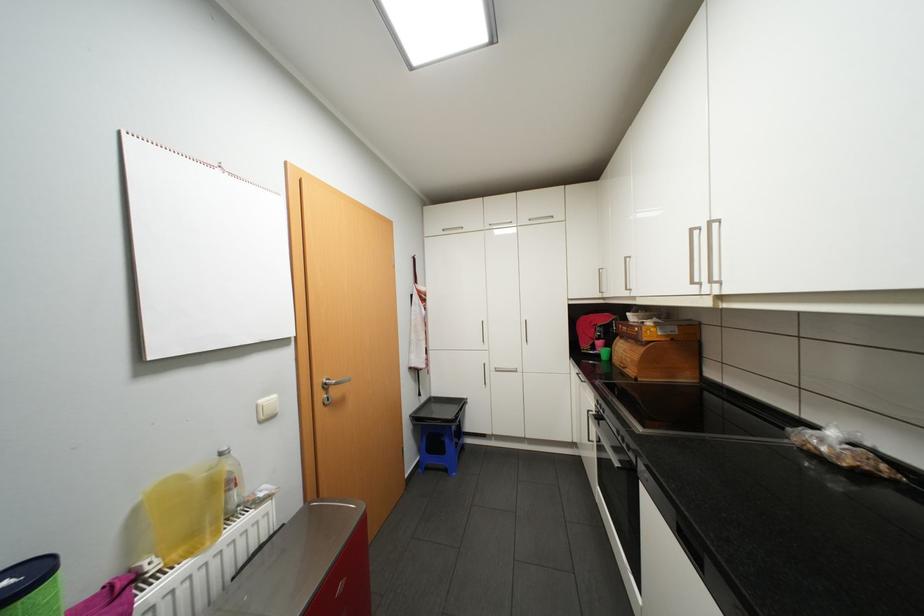
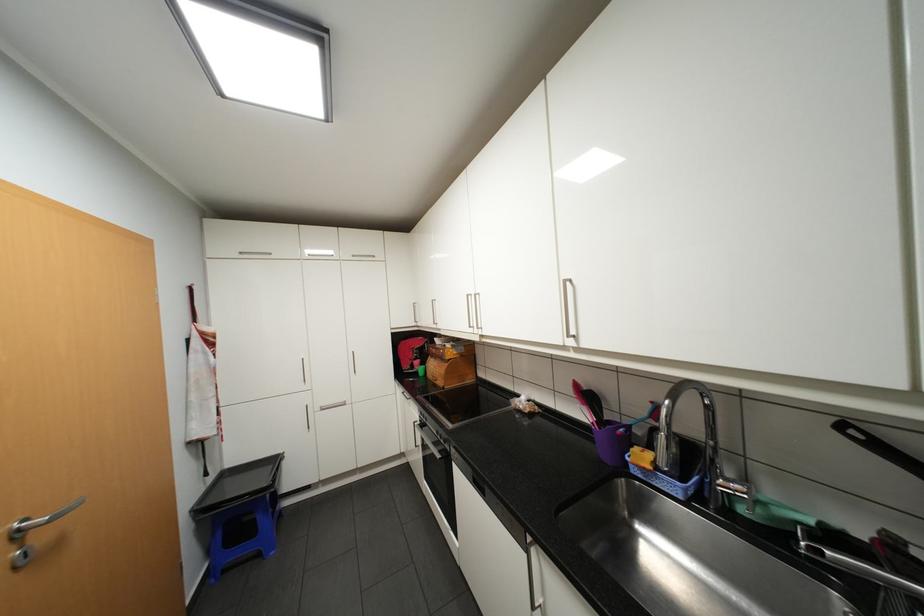
In the second image, find the point that corresponds to the point at 623,292 in the first image.

(434, 323)